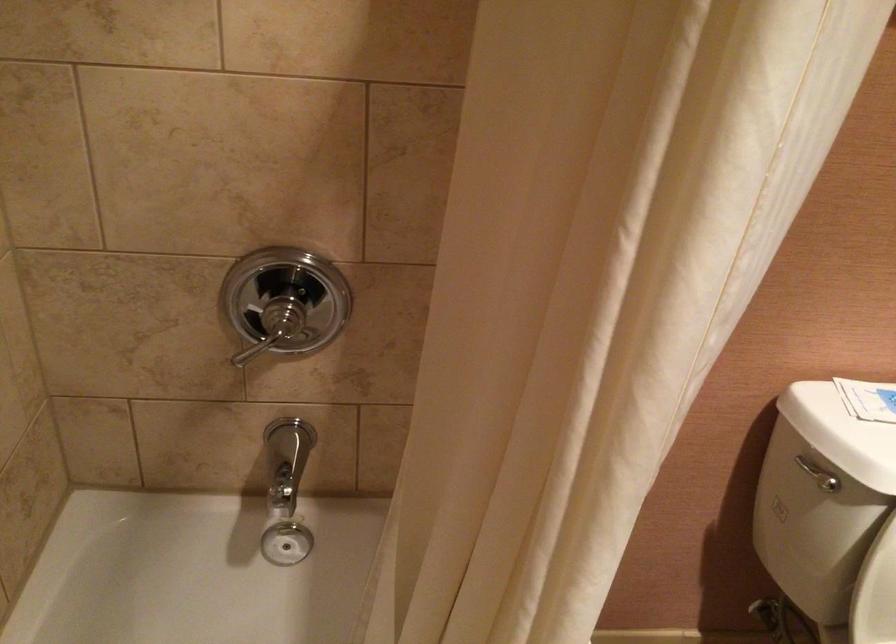
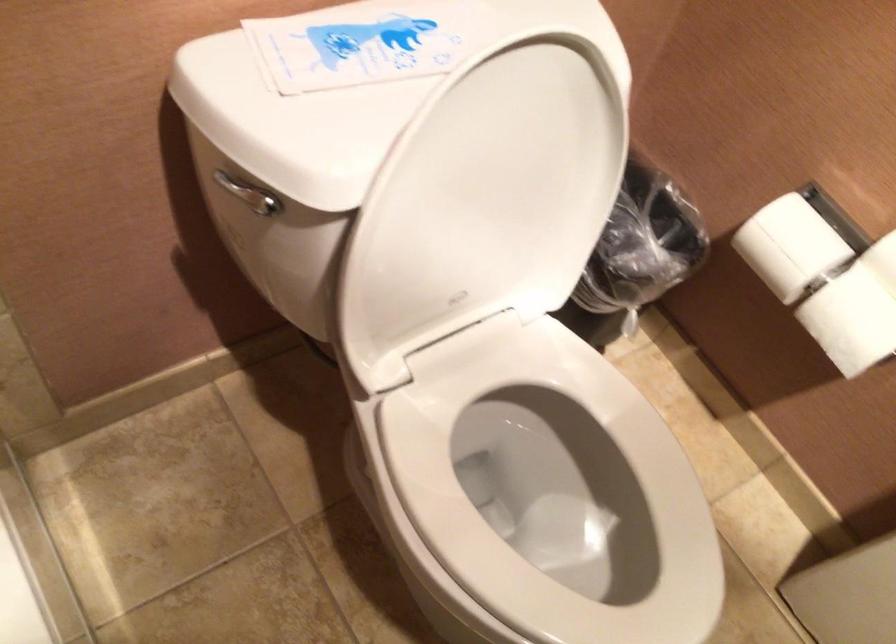
First-person continuous shooting, in which direction is the camera rotating?

The camera rotated toward right-down.